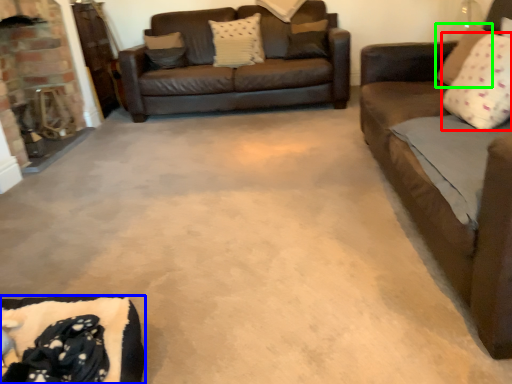
Question: Which object is positioned closest to pillow (highlighted by a red box)? Select from couch (highlighted by a blue box) and pillow (highlighted by a green box).

Choices:
 (A) couch
 (B) pillow

Answer: (B)